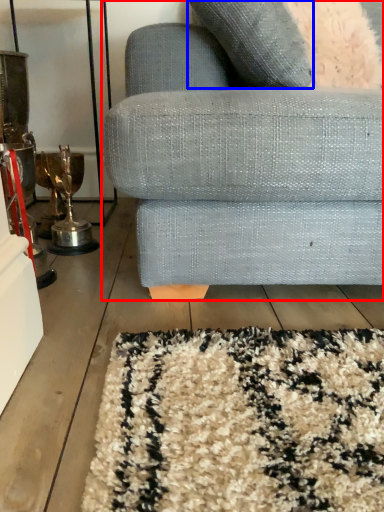
Question: Which object is further to the camera taking this photo, studio couch (highlighted by a red box) or throw pillow (highlighted by a blue box)?

Choices:
 (A) studio couch
 (B) throw pillow

Answer: (B)